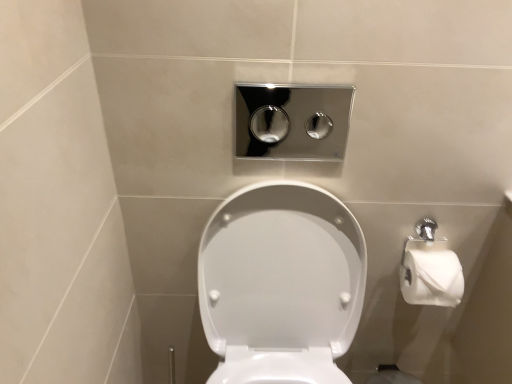
Question: Is point (271, 155) positioned closer to the camera than point (286, 261)?

Choices:
 (A) closer
 (B) farther

Answer: (B)

Question: Considering the relative positions of polished chrome flush buttons at upper center and white glossy toilet at center in the image provided, is polished chrome flush buttons at upper center to the left or to the right of white glossy toilet at center?

Choices:
 (A) right
 (B) left

Answer: (A)

Question: Is polished chrome flush buttons at upper center inside the boundaries of white glossy toilet at center, or outside?

Choices:
 (A) inside
 (B) outside

Answer: (B)

Question: Looking at their shapes, would you say white glossy toilet at center is wider or thinner than polished chrome flush buttons at upper center?

Choices:
 (A) wide
 (B) thin

Answer: (A)

Question: From their relative heights in the image, would you say white glossy toilet at center is taller or shorter than polished chrome flush buttons at upper center?

Choices:
 (A) tall
 (B) short

Answer: (A)

Question: Relative to polished chrome flush buttons at upper center, is white glossy toilet at center in front or behind?

Choices:
 (A) front
 (B) behind

Answer: (A)

Question: Choose the correct answer: Is white glossy toilet at center inside polished chrome flush buttons at upper center or outside it?

Choices:
 (A) outside
 (B) inside

Answer: (A)